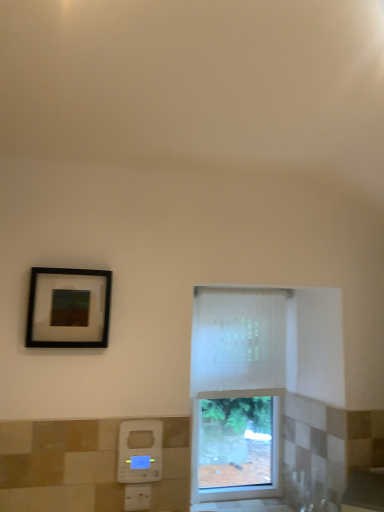
Question: From a real-world perspective, is white sheer curtain at center above or below matte black picture frame at upper left?

Choices:
 (A) below
 (B) above

Answer: (A)

Question: In the image, is white sheer curtain at center on the left side or the right side of matte black picture frame at upper left?

Choices:
 (A) right
 (B) left

Answer: (A)

Question: Which of these objects is positioned closest to the white sheer curtain at center?

Choices:
 (A) matte black picture frame at upper left
 (B) white textured window at center
 (C) white plastic hand dryer at lower center

Answer: (B)

Question: Estimate the real-world distances between objects in this image. Which object is closer to the white sheer curtain at center?

Choices:
 (A) matte black picture frame at upper left
 (B) white textured window at center
 (C) white plastic hand dryer at lower center

Answer: (B)